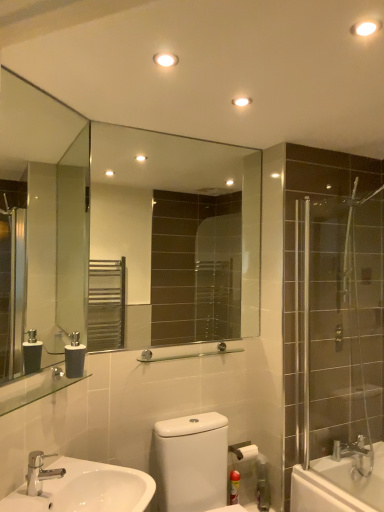
Question: From the image's perspective, is chrome metallic faucet at lower left below white glossy toilet at lower center?

Choices:
 (A) yes
 (B) no

Answer: (B)

Question: Is chrome metallic faucet at lower left bigger than white glossy toilet at lower center?

Choices:
 (A) yes
 (B) no

Answer: (B)

Question: Considering the relative sizes of chrome metallic faucet at lower left and white glossy toilet at lower center in the image provided, is chrome metallic faucet at lower left smaller than white glossy toilet at lower center?

Choices:
 (A) no
 (B) yes

Answer: (B)

Question: Is white glossy toilet at lower center surrounded by chrome metallic faucet at lower left?

Choices:
 (A) yes
 (B) no

Answer: (B)

Question: Is chrome metallic faucet at lower left completely or partially outside of white glossy toilet at lower center?

Choices:
 (A) no
 (B) yes

Answer: (B)

Question: Can you confirm if chrome metallic faucet at lower left is taller than white glossy toilet at lower center?

Choices:
 (A) no
 (B) yes

Answer: (A)

Question: Can you confirm if white glossy toilet at lower center is thinner than clear glass mirror at center, which is the second mirror in front-to-back order?

Choices:
 (A) yes
 (B) no

Answer: (B)

Question: Is white glossy toilet at lower center taller than clear glass mirror at center, acting as the second mirror starting from the left?

Choices:
 (A) no
 (B) yes

Answer: (A)

Question: From a real-world perspective, is white glossy toilet at lower center on clear glass mirror at center, acting as the second mirror starting from the left?

Choices:
 (A) yes
 (B) no

Answer: (B)

Question: From a real-world perspective, is white glossy toilet at lower center below clear glass mirror at center, the 1th mirror viewed from the right?

Choices:
 (A) yes
 (B) no

Answer: (A)

Question: Is white glossy toilet at lower center completely or partially outside of clear glass mirror at center, which is the second mirror in front-to-back order?

Choices:
 (A) no
 (B) yes

Answer: (B)

Question: Is white glossy toilet at lower center to the right of clear glass mirror at center, which is the second mirror in front-to-back order, from the viewer's perspective?

Choices:
 (A) yes
 (B) no

Answer: (A)

Question: Could matte plastic canister at lower right be considered to be inside white glossy sink at lower left?

Choices:
 (A) no
 (B) yes

Answer: (A)